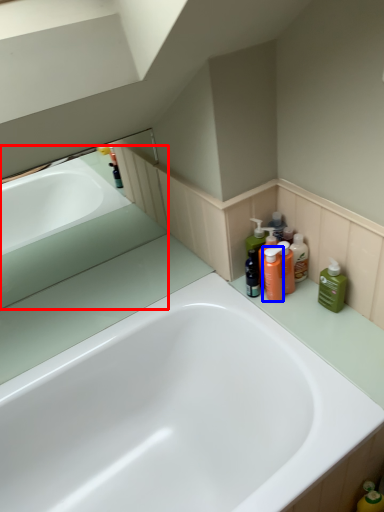
Question: Among these objects, which one is farthest to the camera, bath (highlighted by a red box) or cleaning product (highlighted by a blue box)?

Choices:
 (A) bath
 (B) cleaning product

Answer: (A)